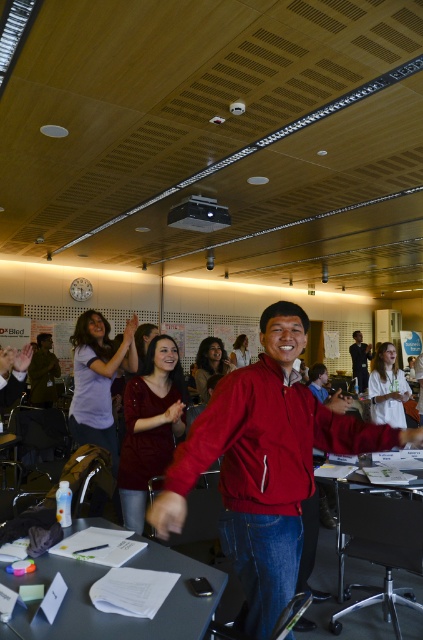
Question: Which is farther from the white paper at center?

Choices:
 (A) matte black projector at upper center
 (B) metallic gray table at center
 (C) matte black jacket at center
 (D) matte red jacket at center

Answer: (C)

Question: Does matte black projector at upper center appear over dark blue shirt at center?

Choices:
 (A) no
 (B) yes

Answer: (B)

Question: Does matte red jacket at center have a greater width compared to matte black projector at upper center?

Choices:
 (A) no
 (B) yes

Answer: (B)

Question: Which point is closer to the camera?

Choices:
 (A) matte black jacket at center
 (B) white paper at center

Answer: (B)

Question: Does matte black jacket at center appear on the right side of dark blue shirt at center?

Choices:
 (A) no
 (B) yes

Answer: (A)

Question: Which point appears closest to the camera in this image?

Choices:
 (A) (379, 588)
 (B) (161, 612)

Answer: (B)